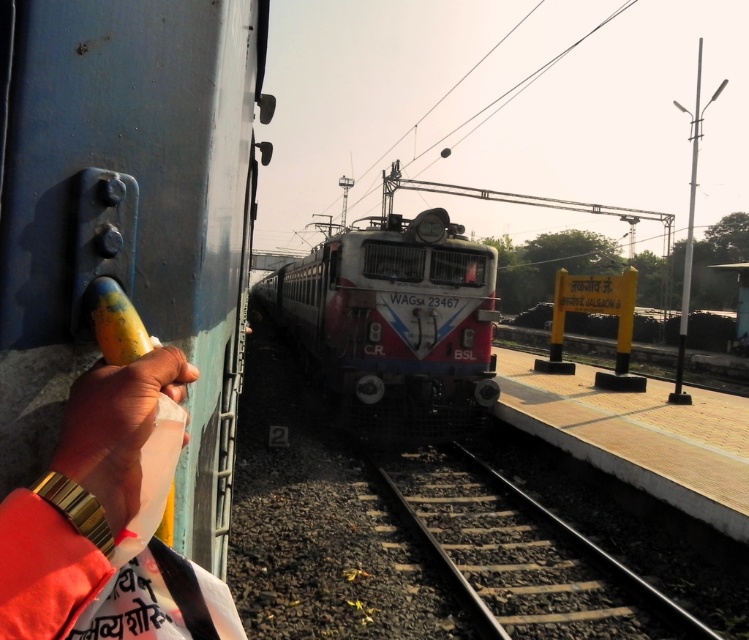
Question: Which object is the farthest from the white glossy train at center?

Choices:
 (A) smooth yellow banana at left
 (B) smooth metal train track at center
 (C) gold watch at left

Answer: (A)

Question: Which object appears closest to the camera in this image?

Choices:
 (A) white glossy train at center
 (B) smooth metal train track at center

Answer: (B)

Question: Is smooth metal train track at center above gold watch at left?

Choices:
 (A) no
 (B) yes

Answer: (A)

Question: Does white glossy train at center appear over gold watch at left?

Choices:
 (A) no
 (B) yes

Answer: (B)

Question: Which object is closer to the camera taking this photo?

Choices:
 (A) white glossy train at center
 (B) smooth metal train track at center

Answer: (B)

Question: Is gold watch at left positioned behind smooth yellow banana at left?

Choices:
 (A) no
 (B) yes

Answer: (A)